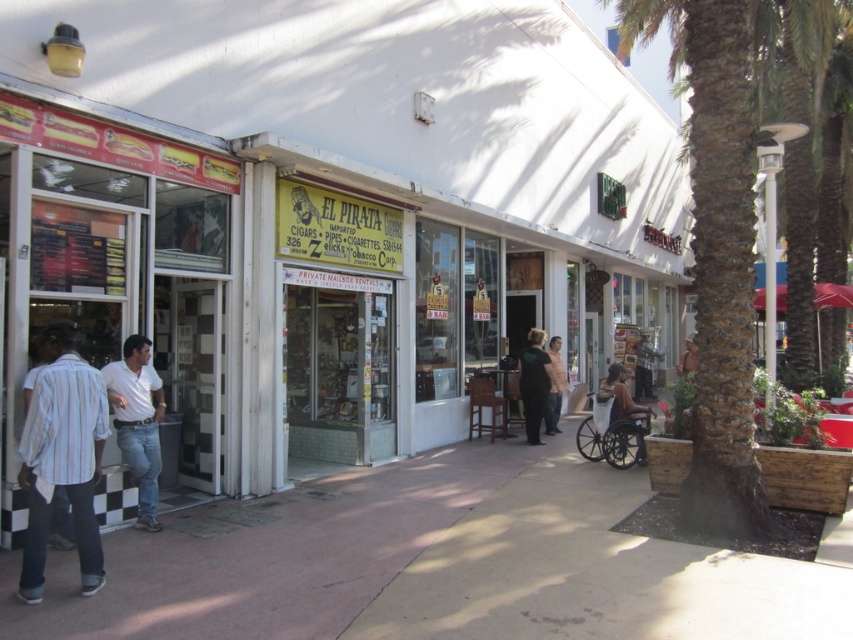
Is point (38, 452) positioned before point (552, 406)?

Yes, point (38, 452) is in front of point (552, 406).

Who is higher up, light blue striped shirt at left or light pink shirt at center?

light blue striped shirt at left is above.

In the scene shown: Who is more forward, [80,492] or [556,420]?

Point [80,492]

Where is `light blue striped shirt at left`? The image size is (853, 640). light blue striped shirt at left is located at coordinates pyautogui.click(x=62, y=458).

Can you confirm if green leafy palm tree at center is positioned to the right of light pink shirt at center?

Yes, green leafy palm tree at center is to the right of light pink shirt at center.

Does green leafy palm tree at center appear under light pink shirt at center?

Incorrect, green leafy palm tree at center is not positioned below light pink shirt at center.

What do you see at coordinates (717, 252) in the screenshot?
I see `green leafy palm tree at center` at bounding box center [717, 252].

Where is `green leafy palm tree at center`? green leafy palm tree at center is located at coordinates (717, 252).

Is brown concrete sidewalk at lower left below light blue striped shirt at left?

Correct, brown concrete sidewalk at lower left is located below light blue striped shirt at left.

Between brown concrete sidewalk at lower left and light blue striped shirt at left, which one has less height?

Standing shorter between the two is brown concrete sidewalk at lower left.

This screenshot has width=853, height=640. I want to click on brown concrete sidewalk at lower left, so click(x=434, y=564).